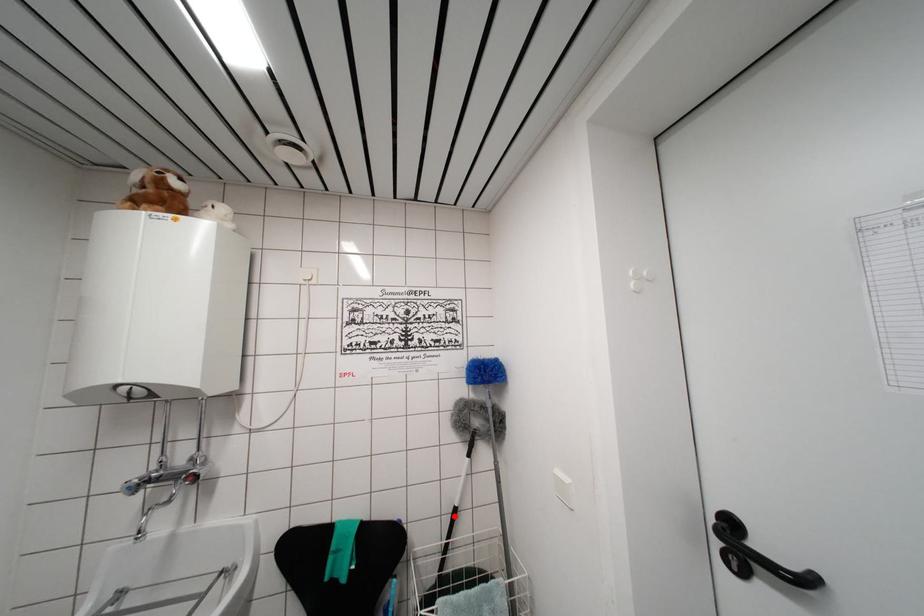
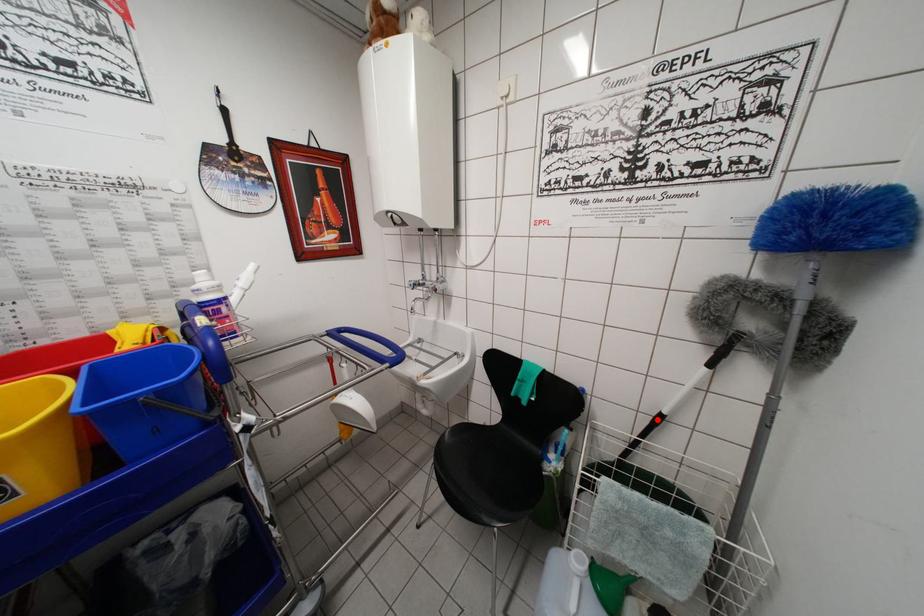
I am providing you with two images of the same scene from different viewpoints. A red point is marked on the first image and another point is marked on the second image. Does the point marked in image1 correspond to the same location as the one in image2?

Yes